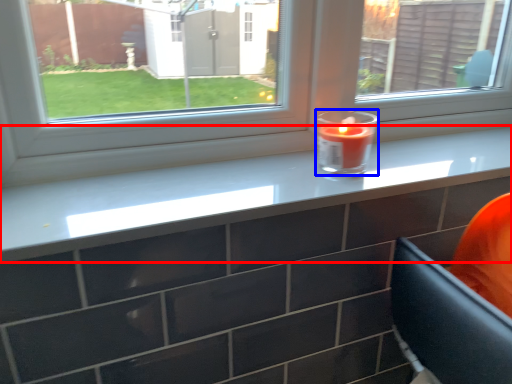
Question: Which point is closer to the camera, counter top (highlighted by a red box) or birthday candle (highlighted by a blue box)?

Choices:
 (A) counter top
 (B) birthday candle

Answer: (A)